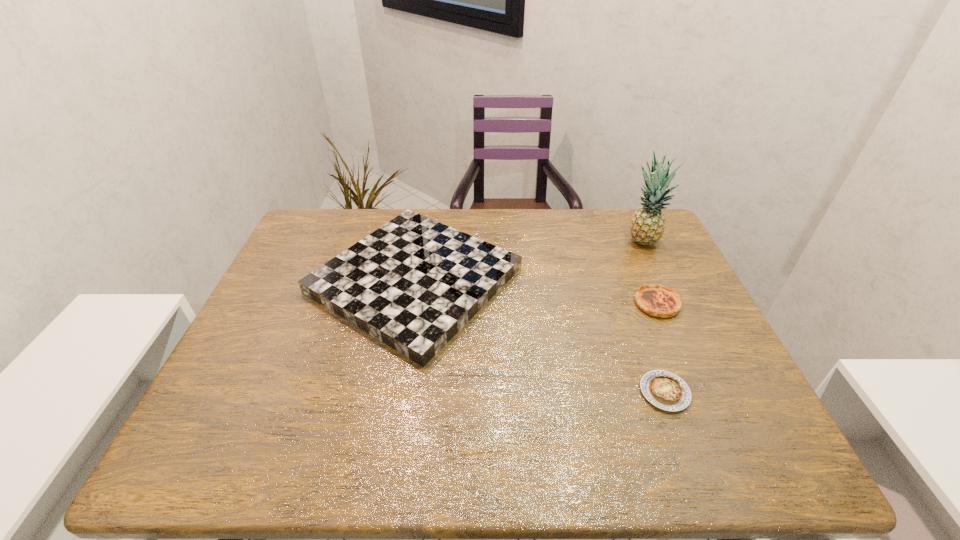
Image resolution: width=960 pixels, height=540 pixels. What are the coordinates of `vacant space that's between the taller quiche and the pineapple` in the screenshot? It's located at (649, 272).

Identify which object is the nearest to the second shortest object. Please provide its 2D coordinates. Your answer should be formatted as a tuple, i.e. [(x, y)], where the tuple contains the x and y coordinates of a point satisfying the conditions above.

[(665, 390)]

Locate an element on the screen. object that is the second closest to the nearer quiche is located at coordinates (414, 283).

You are a GUI agent. You are given a task and a screenshot of the screen. Output one action in this format:
    pyautogui.click(x=<x>, y=<y>)
    Task: Click on the free space in the image that satisfies the following two spatial constraints: 1. on the back side of the tallest object; 2. on the right side of the leftmost object
    The image size is (960, 540).
    Given the screenshot: What is the action you would take?
    pyautogui.click(x=421, y=240)

Image resolution: width=960 pixels, height=540 pixels. Identify the location of free spot that satisfies the following two spatial constraints: 1. on the back side of the second shortest object; 2. on the right side of the tallest object. pyautogui.click(x=630, y=240).